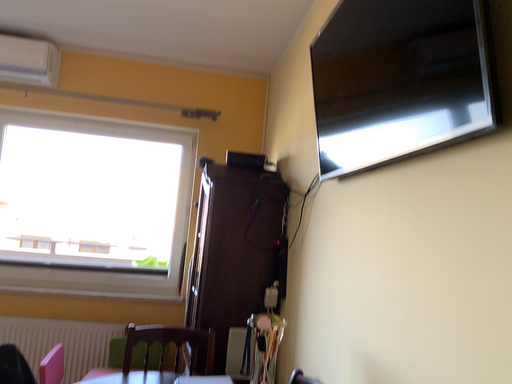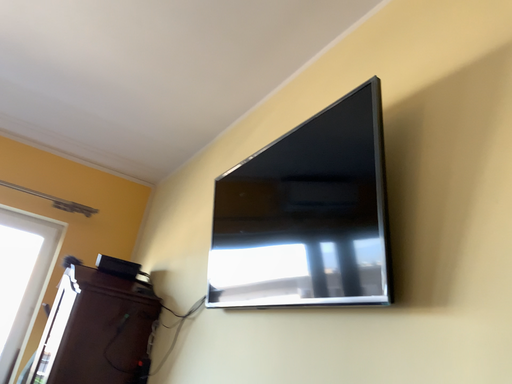
Question: Which way did the camera rotate in the video?

Choices:
 (A) rotated right
 (B) rotated left

Answer: (A)